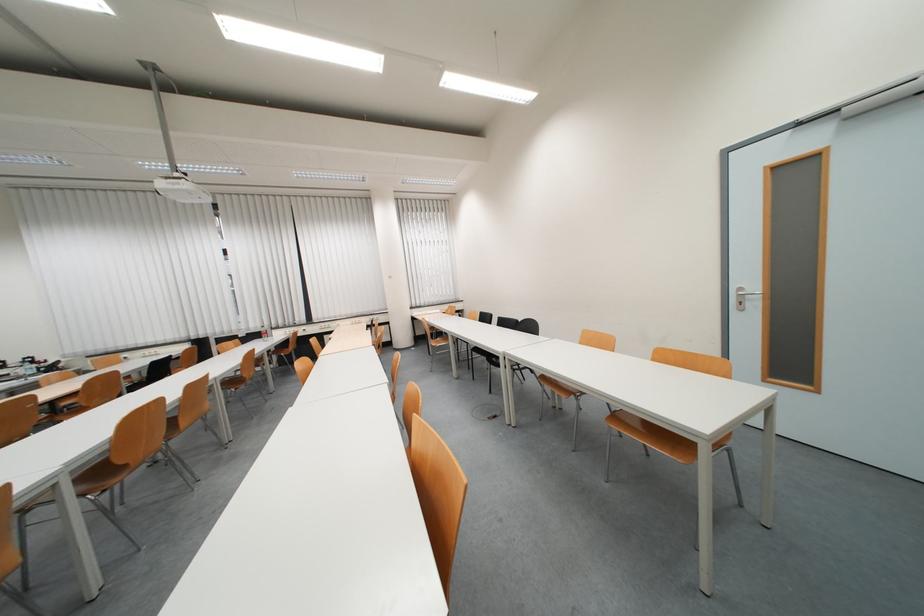
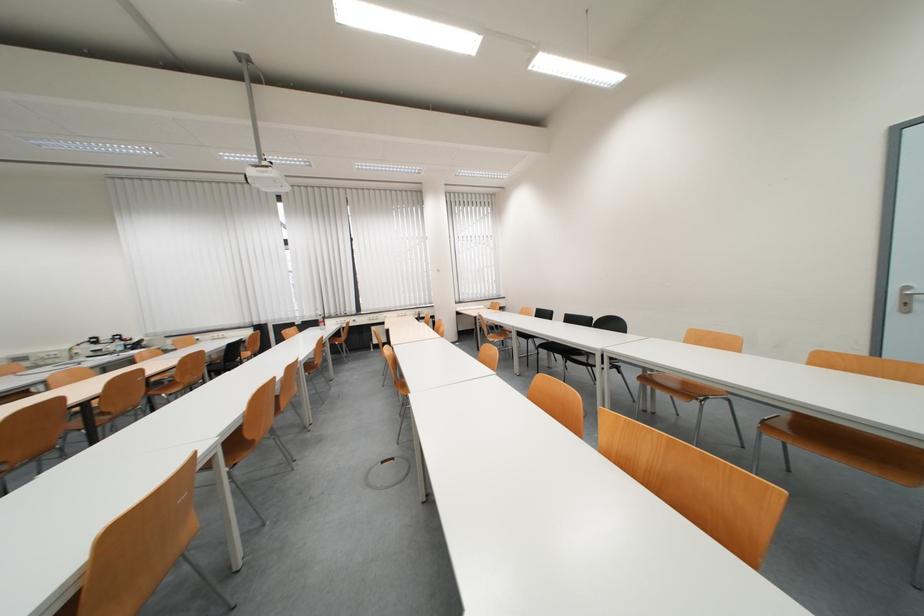
Question: In a continuous first-person perspective shot, in which direction is the camera moving?

Choices:
 (A) Left
 (B) Right
 (C) Forward
 (D) Backward

Answer: (A)